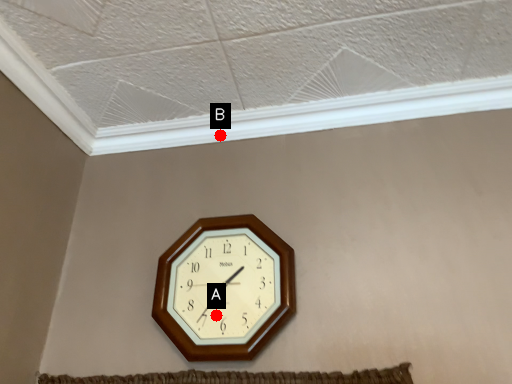
Question: Two points are circled on the image, labeled by A and B beside each circle. Which point is closer to the camera taking this photo?

Choices:
 (A) A is closer
 (B) B is closer

Answer: (A)